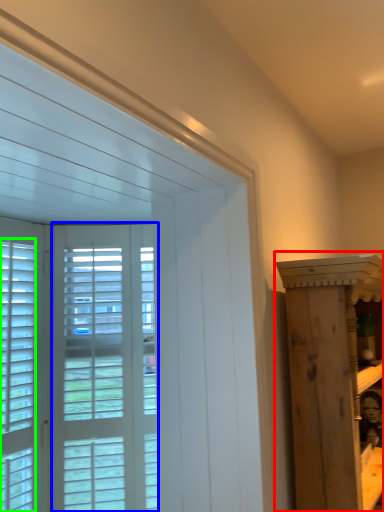
Question: Considering the real-world distances, which object is closest to furniture (highlighted by a red box)? screen door (highlighted by a blue box) or window (highlighted by a green box).

Choices:
 (A) screen door
 (B) window

Answer: (A)